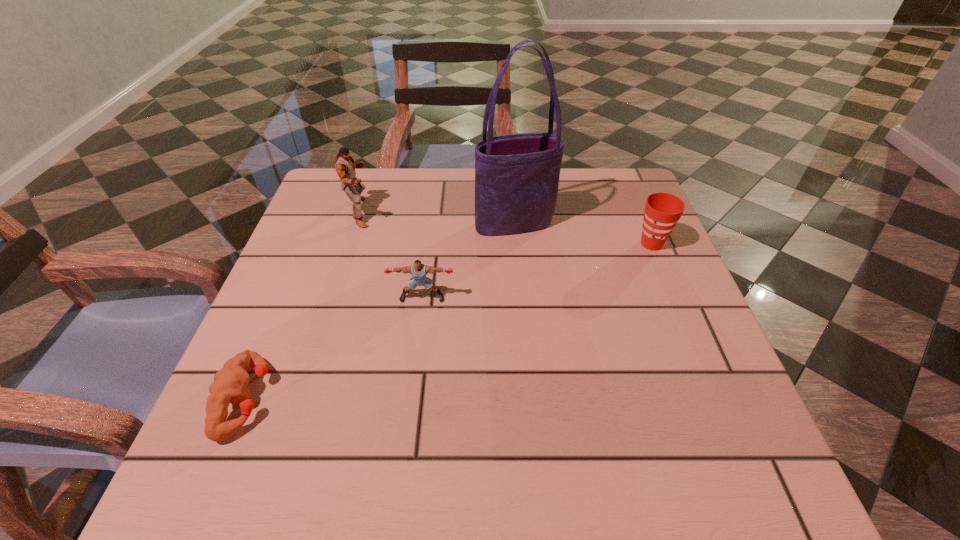
Locate an element on the screen. This screenshot has width=960, height=540. the second object from right to left is located at coordinates (517, 176).

Find the location of a particular element. The height and width of the screenshot is (540, 960). tote bag is located at coordinates (517, 176).

Locate an element on the screen. The image size is (960, 540). the farthest puncher is located at coordinates (345, 165).

Where is `the second puncher from left to right`? the second puncher from left to right is located at coordinates (345, 165).

Where is `the rightmost object`? The image size is (960, 540). the rightmost object is located at coordinates (662, 211).

Identify the location of the second nearest puncher. (418, 270).

What are the coordinates of `the second tallest puncher` in the screenshot? It's located at [418, 270].

Where is `the nearest puncher`? The height and width of the screenshot is (540, 960). the nearest puncher is located at coordinates (230, 383).

This screenshot has width=960, height=540. Identify the location of the leftmost puncher. (230, 383).

At what (x,y) coordinates should I click in order to perform the action: click on vacant space located 0.340m on the left of the tote bag. Please return your answer as a coordinate pair (x, y). Looking at the image, I should click on (335, 224).